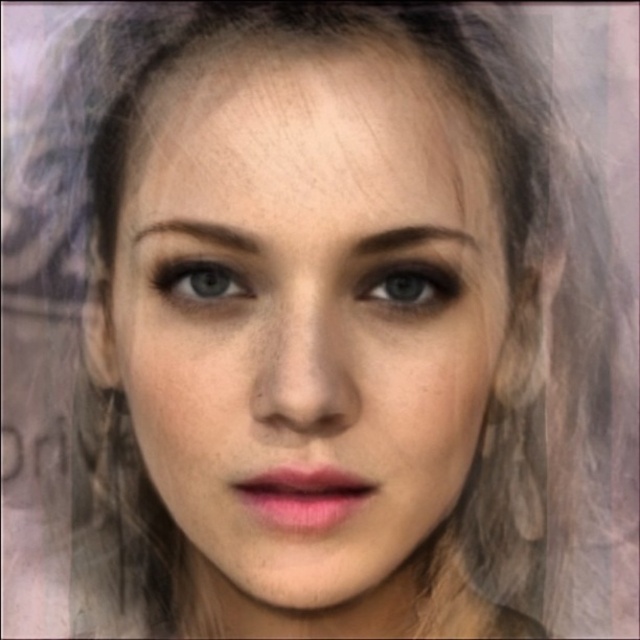
Question: In this image, where is matte blue eye at center located relative to brown matte eyebrow at upper left?

Choices:
 (A) right
 (B) left

Answer: (A)

Question: Among these objects, which one is nearest to the camera?

Choices:
 (A) brown matte eyebrow at center
 (B) blue matte eye at center
 (C) brown matte eyebrow at upper left

Answer: (A)

Question: Does blue matte eye at center come in front of brown matte eyebrow at center?

Choices:
 (A) no
 (B) yes

Answer: (A)

Question: Which point is farther from the camera taking this photo?

Choices:
 (A) tap(236, 272)
 (B) tap(452, 234)

Answer: (B)

Question: Which of the following is the farthest from the observer?

Choices:
 (A) brown matte eyebrow at center
 (B) blue matte eye at center
 (C) smooth skin face at center

Answer: (B)

Question: Can you confirm if matte blue eye at center is positioned above brown matte eyebrow at upper left?

Choices:
 (A) yes
 (B) no

Answer: (B)